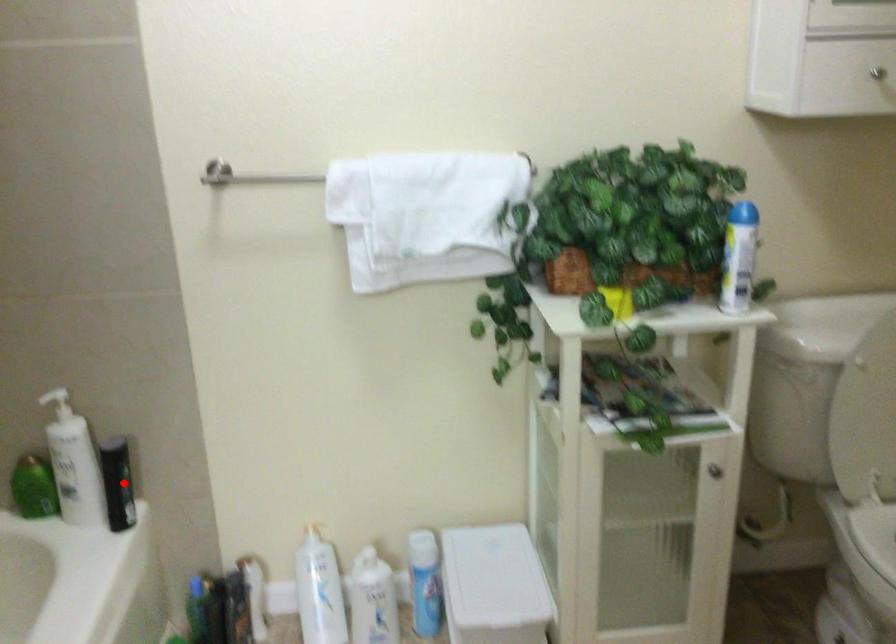
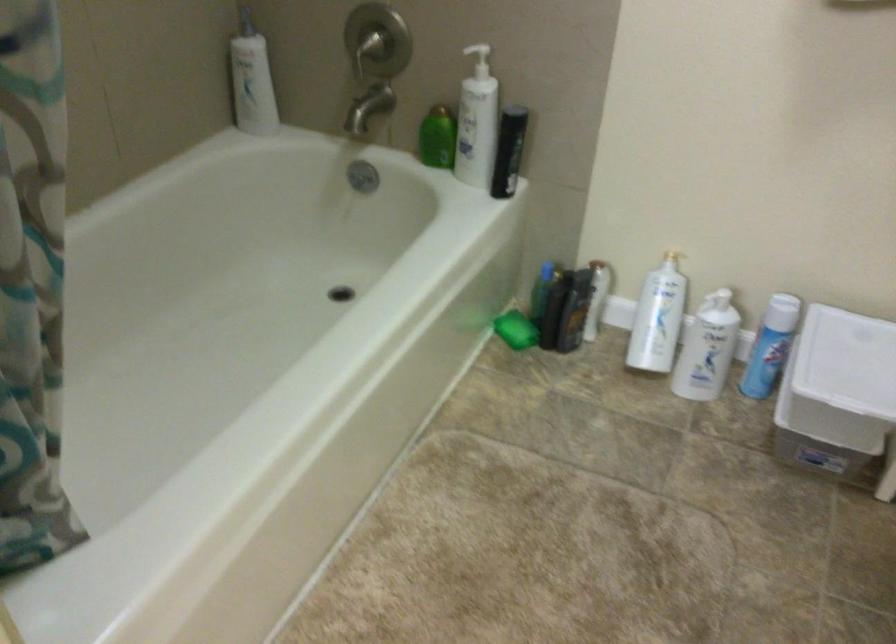
In the second image, find the point that corresponds to the highlighted location in the first image.

(509, 152)